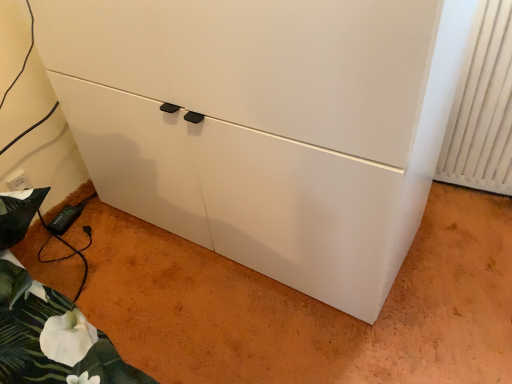
Describe the element at coordinates (255, 128) in the screenshot. Image resolution: width=512 pixels, height=384 pixels. I see `white matte cabinet at center` at that location.

At what (x,y) coordinates should I click in order to perform the action: click on white matte cabinet at center. Please return your answer as a coordinate pair (x, y). The height and width of the screenshot is (384, 512). Looking at the image, I should click on (255, 128).

Locate an element on the screen. The image size is (512, 384). white matte cabinet at center is located at coordinates (255, 128).